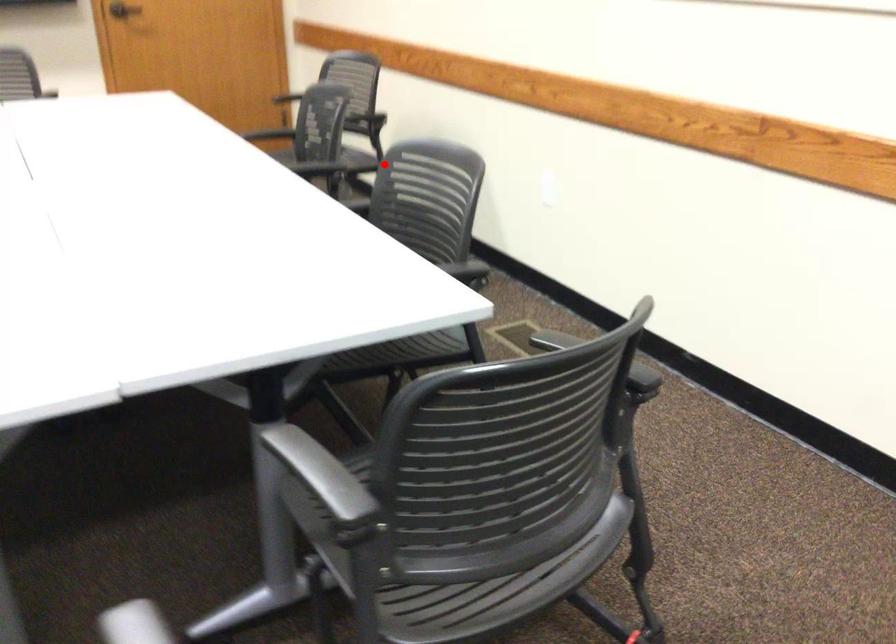
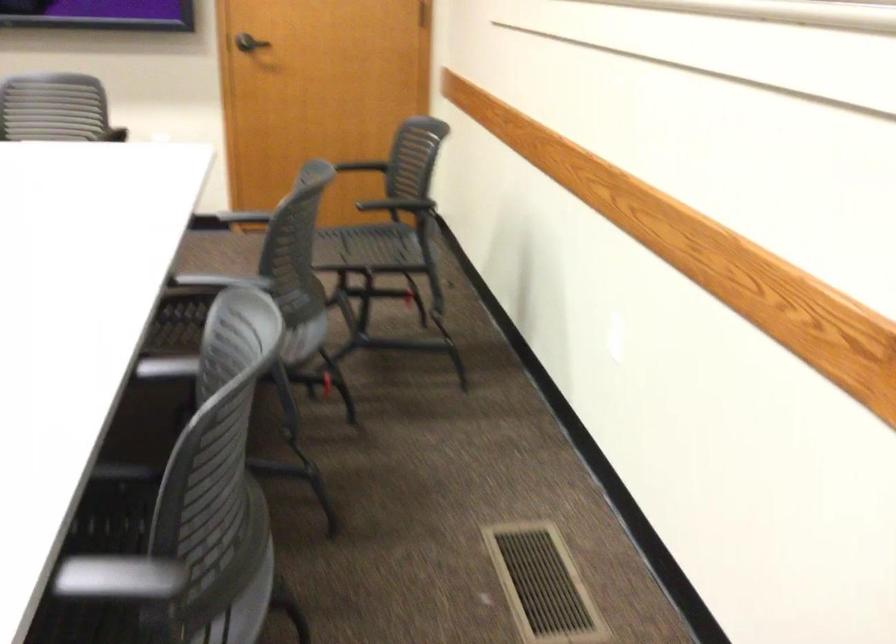
The point at the highlighted location is marked in the first image. Where is the corresponding point in the second image?

(225, 319)